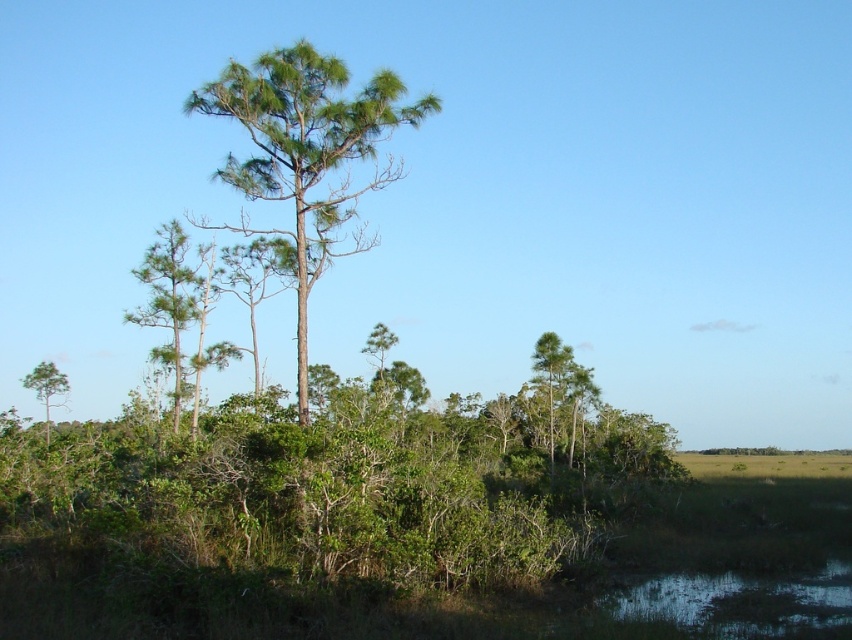
Question: Considering the relative positions of green textured tree at center and green leafy tree at lower left in the image provided, where is green textured tree at center located with respect to green leafy tree at lower left?

Choices:
 (A) below
 (B) above

Answer: (B)

Question: Which of the following is the farthest from the observer?

Choices:
 (A) green leafy tree at lower left
 (B) greenish reflective water at lower right
 (C) green textured tree at center
 (D) green leafy tree at left

Answer: (A)

Question: Which object is the closest to the green leafy tree at left?

Choices:
 (A) greenish reflective water at lower right
 (B) green leafy tree at lower left

Answer: (B)

Question: Can you confirm if greenish reflective water at lower right is smaller than green leafy tree at lower left?

Choices:
 (A) yes
 (B) no

Answer: (A)

Question: Observing the image, what is the correct spatial positioning of green leafy tree at left in reference to green leafy tree at lower left?

Choices:
 (A) left
 (B) right

Answer: (B)

Question: Which object is positioned farthest from the green textured tree at center?

Choices:
 (A) greenish reflective water at lower right
 (B) green leafy tree at left

Answer: (B)